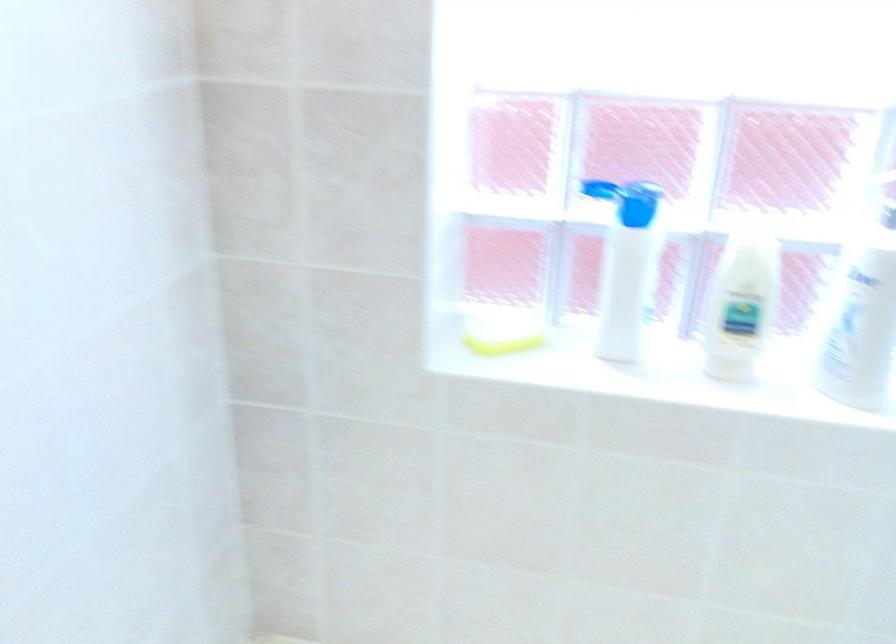
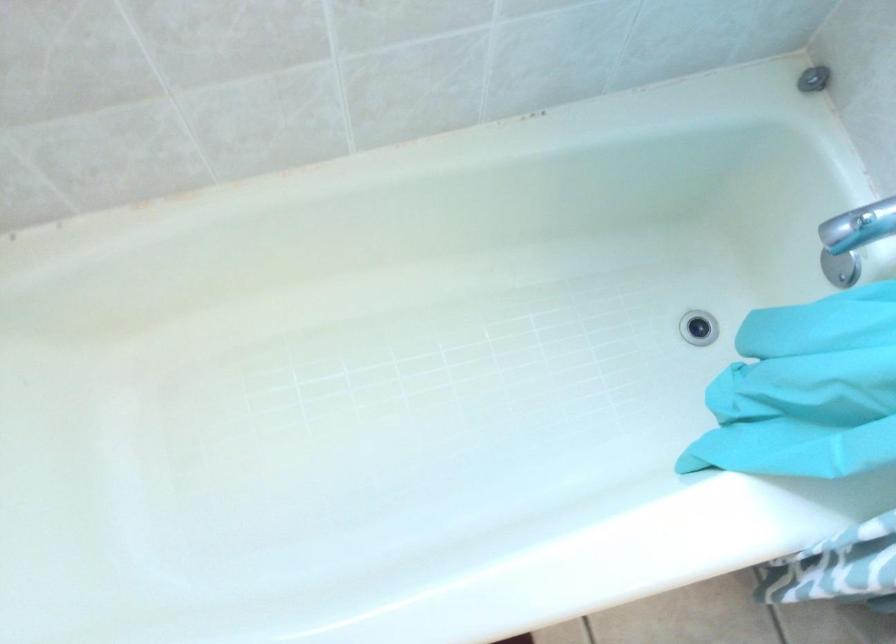
Question: How did the camera likely rotate?

Choices:
 (A) Left
 (B) Right
 (C) Up
 (D) Down

Answer: (D)